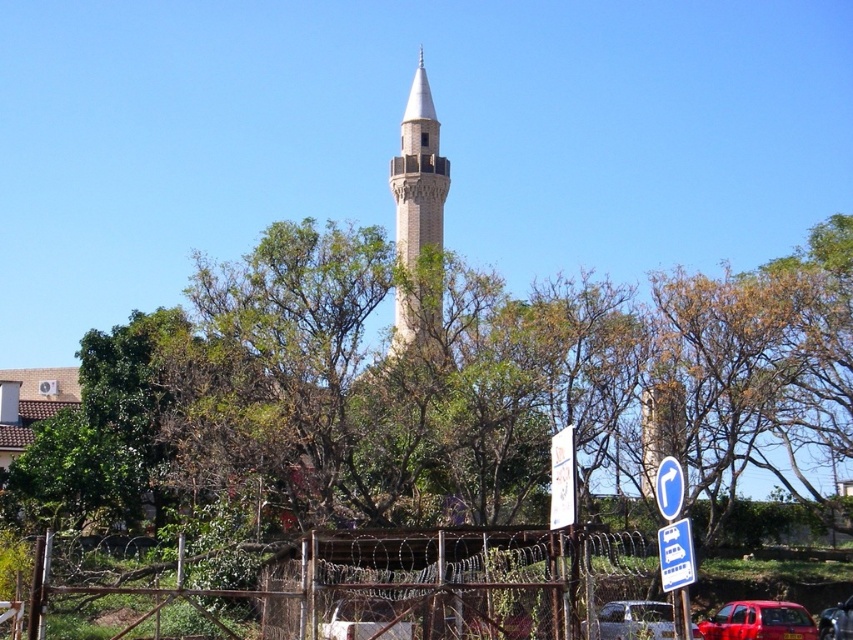
Who is more forward, (334, 241) or (659, 560)?

Point (659, 560)

Which is above, green leafy tree at center or yellow plastic sign at lower right?

green leafy tree at center

In the scene shown: Measure the distance between point (814, 497) and camera.

Point (814, 497) is 363.57 feet away from camera.

Locate an element on the screen. Image resolution: width=853 pixels, height=640 pixels. green leafy tree at center is located at coordinates (438, 385).

Which is behind, point (428, 116) or point (567, 488)?

Point (428, 116)

Is point (410, 136) positioned before point (560, 524)?

No, (410, 136) is further to viewer.

Find the location of `light beige stone minaret at center`. light beige stone minaret at center is located at coordinates (418, 173).

Is the position of light beige stone minaret at center more distant than that of shiny red car at lower right?

Yes, light beige stone minaret at center is behind shiny red car at lower right.

Who is more distant from viewer, (408, 148) or (799, 612)?

Positioned behind is point (408, 148).

You are a GUI agent. You are given a task and a screenshot of the screen. Output one action in this format:
    pyautogui.click(x=<x>, y=<y>)
    Task: Click on the light beige stone minaret at center
    The width and height of the screenshot is (853, 640).
    Given the screenshot: What is the action you would take?
    pyautogui.click(x=418, y=173)